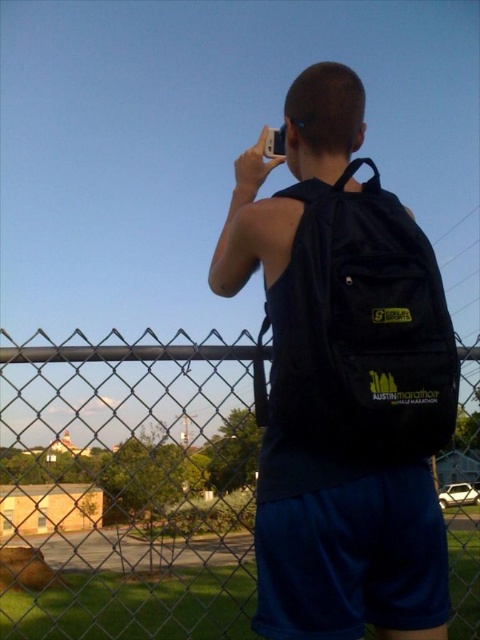
Can you confirm if black matte backpack at center is positioned to the left of metal chain-link fence at center?

Yes, black matte backpack at center is to the left of metal chain-link fence at center.

Which is more to the right, black matte backpack at center or metal chain-link fence at center?

From the viewer's perspective, metal chain-link fence at center appears more on the right side.

Does point (415, 422) come behind point (93, 445)?

No, it is in front of (93, 445).

Find the location of a particular element. The image size is (480, 640). black matte backpack at center is located at coordinates (344, 381).

Does metal chain-link fence at center have a lesser width compared to black fabric backpack at center?

No.

Is metal chain-link fence at center positioned behind black fabric backpack at center?

That is True.

Locate an element on the screen. The image size is (480, 640). metal chain-link fence at center is located at coordinates (129, 484).

This screenshot has height=640, width=480. In order to click on metal chain-link fence at center in this screenshot , I will do `click(129, 484)`.

Can you confirm if black matte backpack at center is positioned above black fabric backpack at center?

Incorrect, black matte backpack at center is not positioned above black fabric backpack at center.

Which is in front, point (321, 193) or point (406, 225)?

Point (406, 225) is in front.

You are a GUI agent. You are given a task and a screenshot of the screen. Output one action in this format:
    pyautogui.click(x=<x>, y=<y>)
    Task: Click on the black matte backpack at center
    Image resolution: width=480 pixels, height=640 pixels.
    Given the screenshot: What is the action you would take?
    pyautogui.click(x=344, y=381)